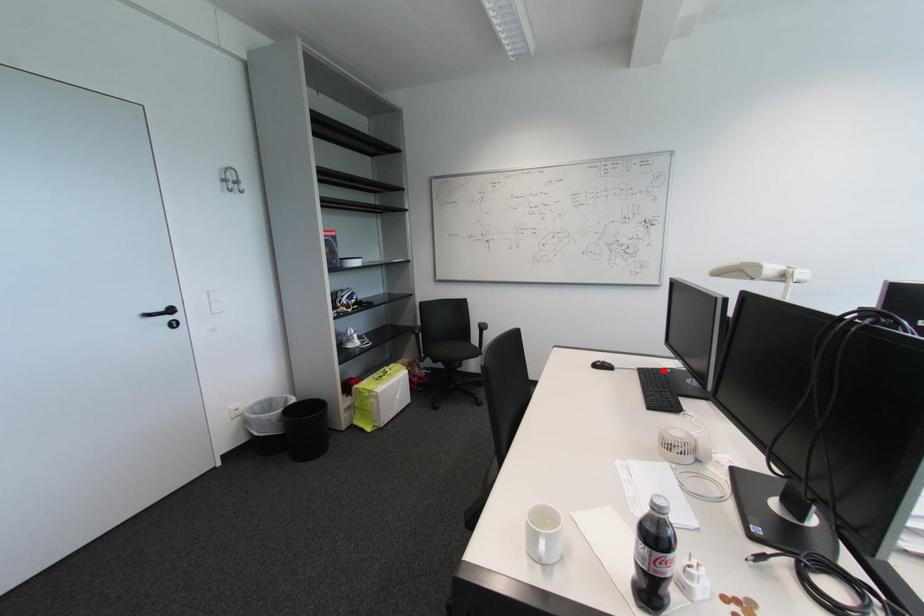
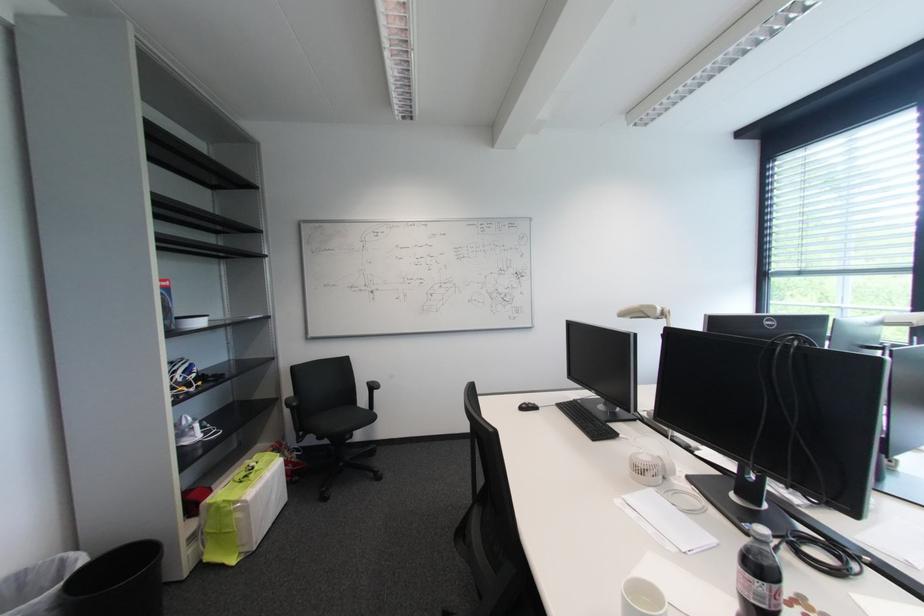
Where in the second image is the point corresponding to the highlighted location from the first image?

(578, 403)